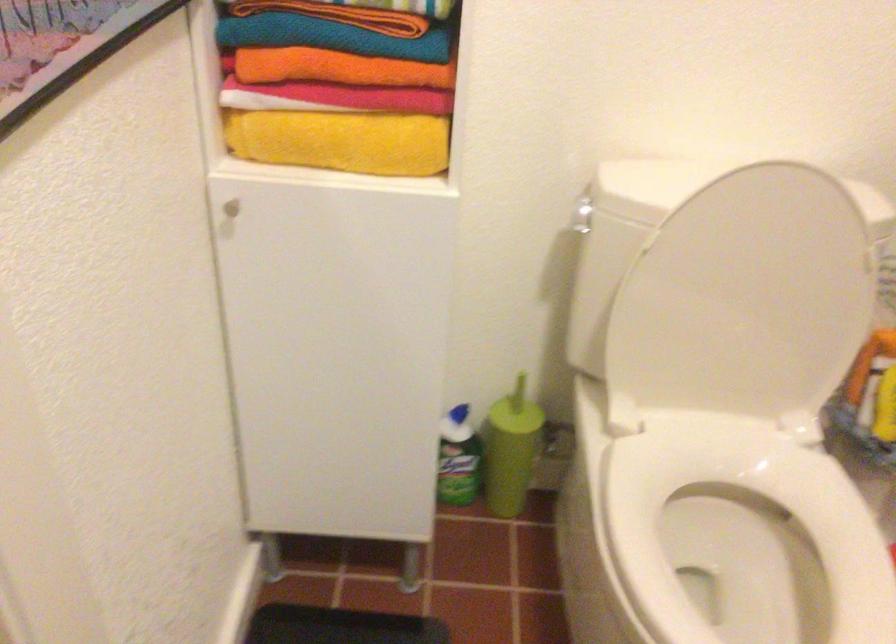
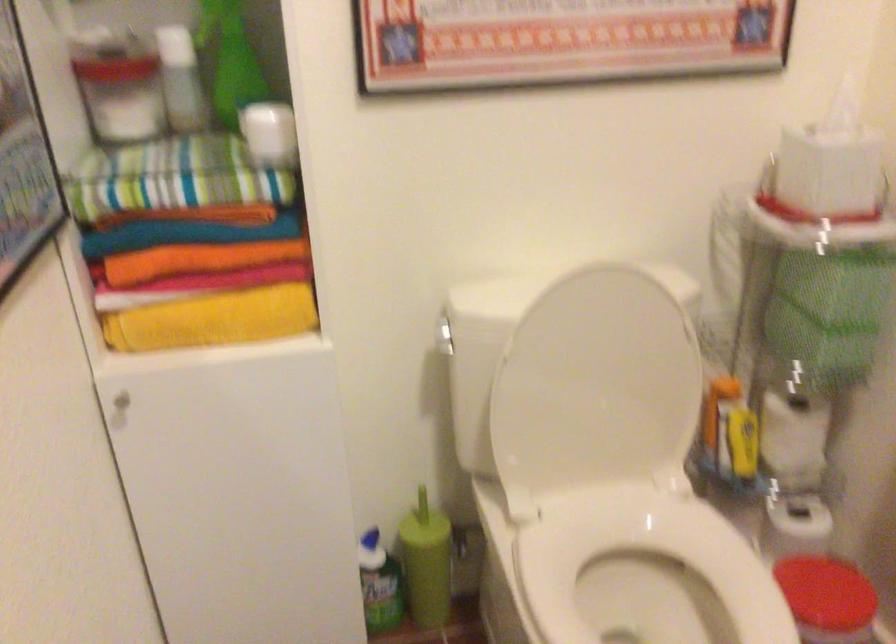
The point at (745, 520) is marked in the first image. Where is the corresponding point in the second image?

(648, 578)